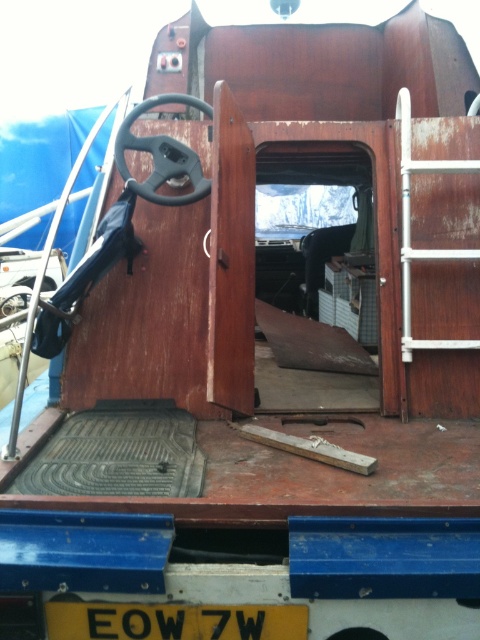
Question: Does black rubber steering wheel at center appear on the right side of matte black steering wheel at center?

Choices:
 (A) no
 (B) yes

Answer: (B)

Question: Which point is closer to the camera?

Choices:
 (A) (25, 291)
 (B) (122, 637)

Answer: (B)

Question: Is yellow matte license plate at bottom to the right of black rubber steering wheel at center from the viewer's perspective?

Choices:
 (A) no
 (B) yes

Answer: (B)

Question: Which of the following is the closest to the observer?

Choices:
 (A) matte black steering wheel at center
 (B) yellow matte license plate at bottom
 (C) black rubber steering wheel at center

Answer: (B)

Question: Estimate the real-world distances between objects in this image. Which object is farther from the matte black steering wheel at center?

Choices:
 (A) black rubber steering wheel at center
 (B) yellow matte license plate at bottom

Answer: (B)

Question: Does yellow matte license plate at bottom have a larger size compared to black rubber steering wheel at center?

Choices:
 (A) yes
 (B) no

Answer: (B)